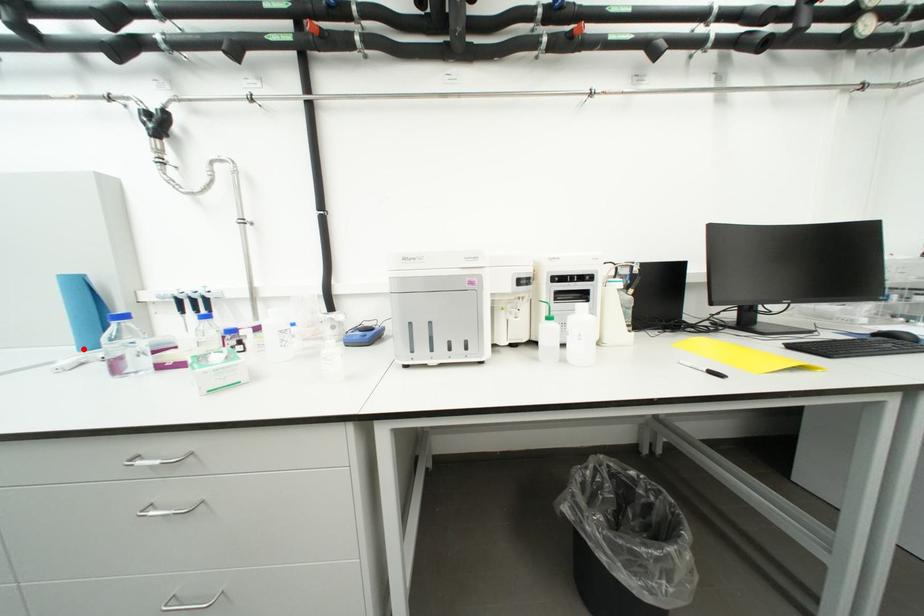
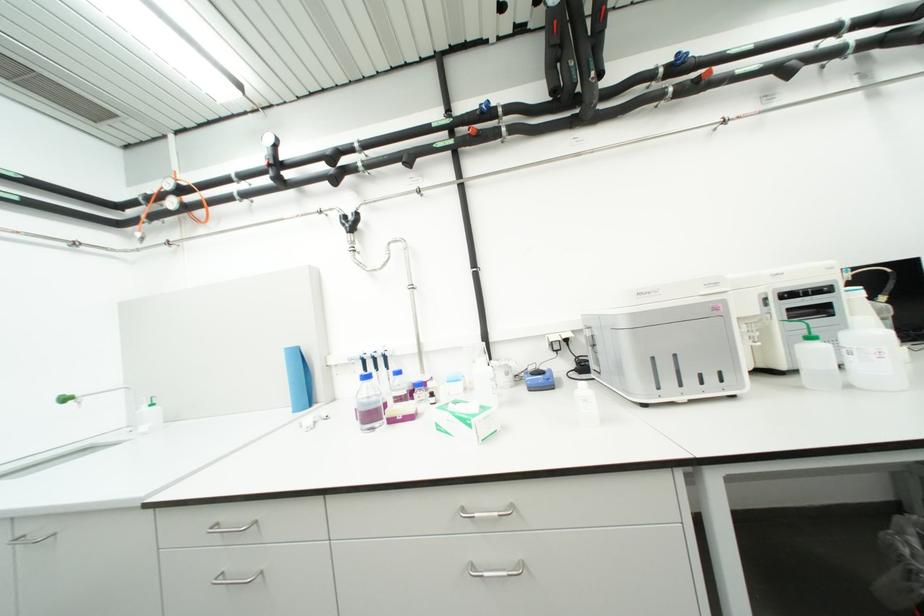
Where in the second image is the point corresponding to the highlighted location from the first image?

(298, 411)